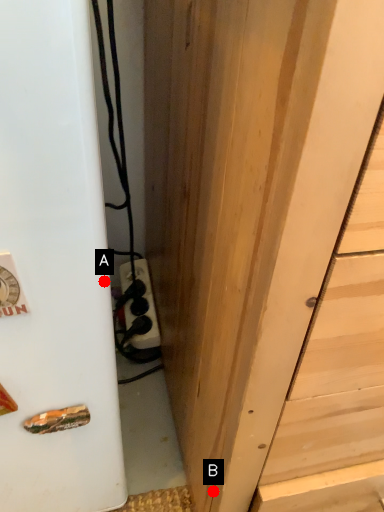
Question: Two points are circled on the image, labeled by A and B beside each circle. Which point is farther from the camera taking this photo?

Choices:
 (A) A is further
 (B) B is further

Answer: (B)